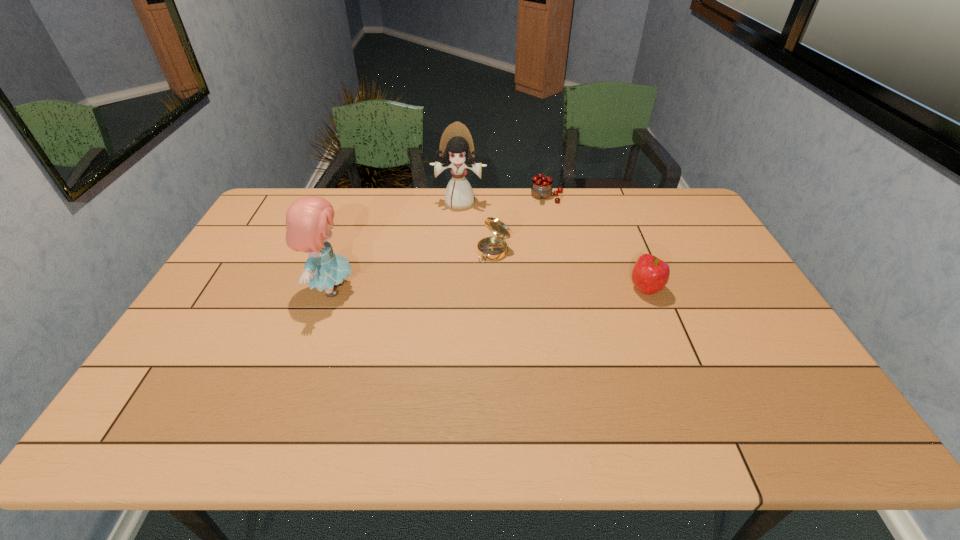
You are a GUI agent. You are given a task and a screenshot of the screen. Output one action in this format:
    pyautogui.click(x=<x>, y=<y>)
    Task: Click on the leftmost object
    
    Given the screenshot: What is the action you would take?
    pyautogui.click(x=309, y=220)

The height and width of the screenshot is (540, 960). Find the location of `the left doll`. the left doll is located at coordinates (309, 220).

You are a GUI agent. You are given a task and a screenshot of the screen. Output one action in this format:
    pyautogui.click(x=<x>, y=<y>)
    Task: Click on the apple
    
    Given the screenshot: What is the action you would take?
    pyautogui.click(x=650, y=275)

This screenshot has width=960, height=540. Identify the location of compass. (490, 248).

This screenshot has height=540, width=960. In order to click on the right doll in this screenshot , I will do `click(456, 151)`.

You are a GUI agent. You are given a task and a screenshot of the screen. Output one action in this format:
    pyautogui.click(x=<x>, y=<y>)
    Task: Click on the second object from right to left
    This screenshot has height=540, width=960.
    Given the screenshot: What is the action you would take?
    (x=541, y=188)

Where is `vacant space located 0.320m on the front-facing side of the left doll`? The height and width of the screenshot is (540, 960). vacant space located 0.320m on the front-facing side of the left doll is located at coordinates (468, 289).

Find the location of a particular element. The image size is (960, 540). free space located 0.290m on the back of the apple is located at coordinates (618, 221).

Where is `free point located with the dial facing the compass`? This screenshot has height=540, width=960. free point located with the dial facing the compass is located at coordinates (424, 317).

This screenshot has width=960, height=540. What are the coordinates of `blank space located 0.220m with the dial facing the compass` in the screenshot? It's located at (441, 302).